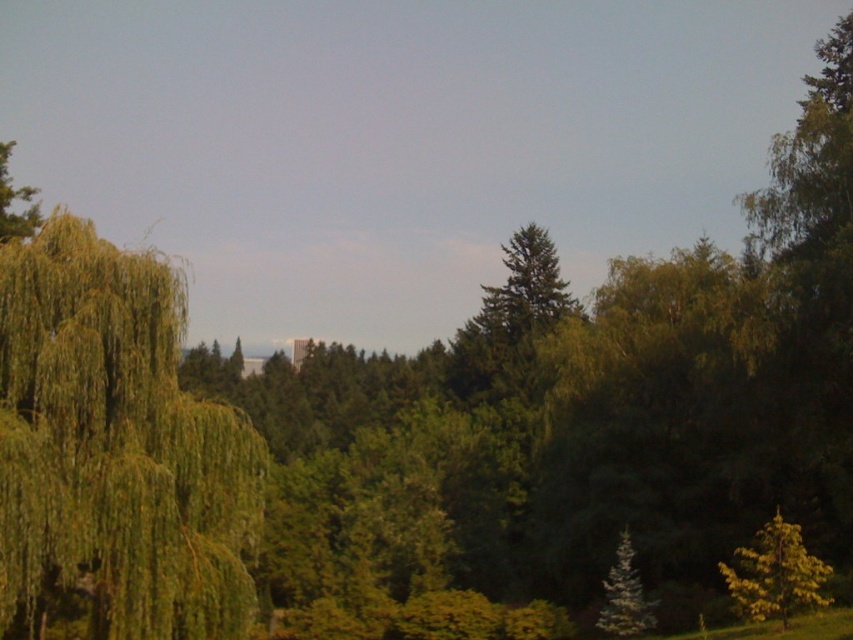
Question: Among these objects, which one is nearest to the camera?

Choices:
 (A) yellow-green leafy tree at lower right
 (B) green matte tree at lower right
 (C) green leafy willow at left

Answer: (A)

Question: Which of the following is the farthest from the observer?

Choices:
 (A) green leafy willow at left
 (B) green matte tree at lower right

Answer: (B)

Question: Does green leafy willow at left have a lesser width compared to yellow-green leafy tree at lower right?

Choices:
 (A) no
 (B) yes

Answer: (B)

Question: Does yellow-green leafy tree at lower right have a larger size compared to green matte tree at lower right?

Choices:
 (A) yes
 (B) no

Answer: (A)

Question: Estimate the real-world distances between objects in this image. Which object is closer to the yellow-green leafy tree at lower right?

Choices:
 (A) green matte tree at lower right
 (B) green leafy willow at left

Answer: (A)

Question: Is green leafy willow at left to the left of yellow-green leafy tree at lower right from the viewer's perspective?

Choices:
 (A) yes
 (B) no

Answer: (A)